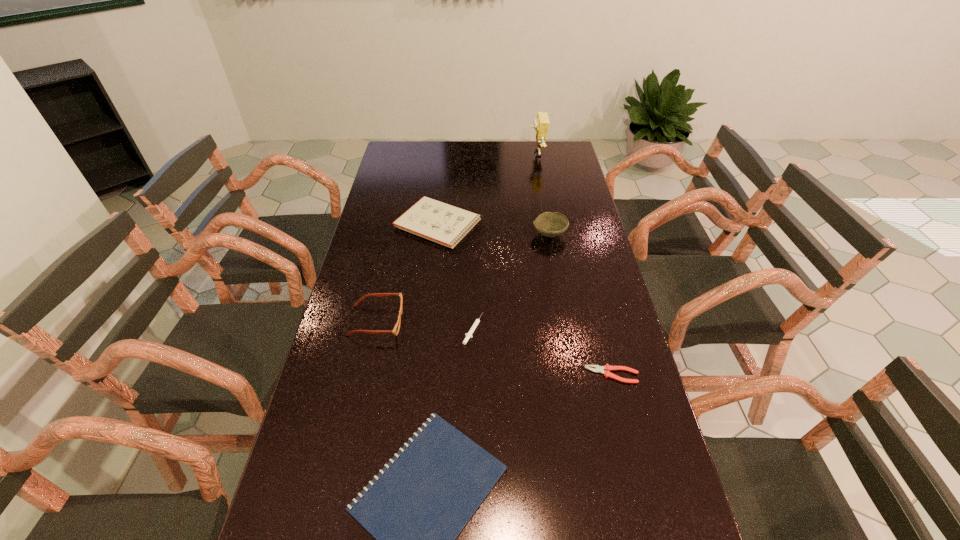
In order to click on the farthest object in this screenshot , I will do (x=541, y=124).

At what (x,y) coordinates should I click in order to perform the action: click on the tallest object. Please return your answer as a coordinate pair (x, y). Looking at the image, I should click on (541, 124).

Locate an element on the screen. Image resolution: width=960 pixels, height=540 pixels. the sixth shortest object is located at coordinates (548, 224).

The width and height of the screenshot is (960, 540). Find the location of `spectacles`. spectacles is located at coordinates (395, 331).

Identify the location of the taller notepad. (445, 224).

Find the location of a particular element. Image resolution: width=960 pixels, height=540 pixels. the farther notepad is located at coordinates (445, 224).

The height and width of the screenshot is (540, 960). Identify the location of syringe. (468, 335).

Locate an element on the screen. The width and height of the screenshot is (960, 540). pliers is located at coordinates (599, 369).

Image resolution: width=960 pixels, height=540 pixels. In order to click on blank space located 0.090m on the face of the farthest object in this screenshot , I will do `click(509, 154)`.

Find the location of a particular element. The width and height of the screenshot is (960, 540). vacant space located 0.160m on the face of the farthest object is located at coordinates (493, 154).